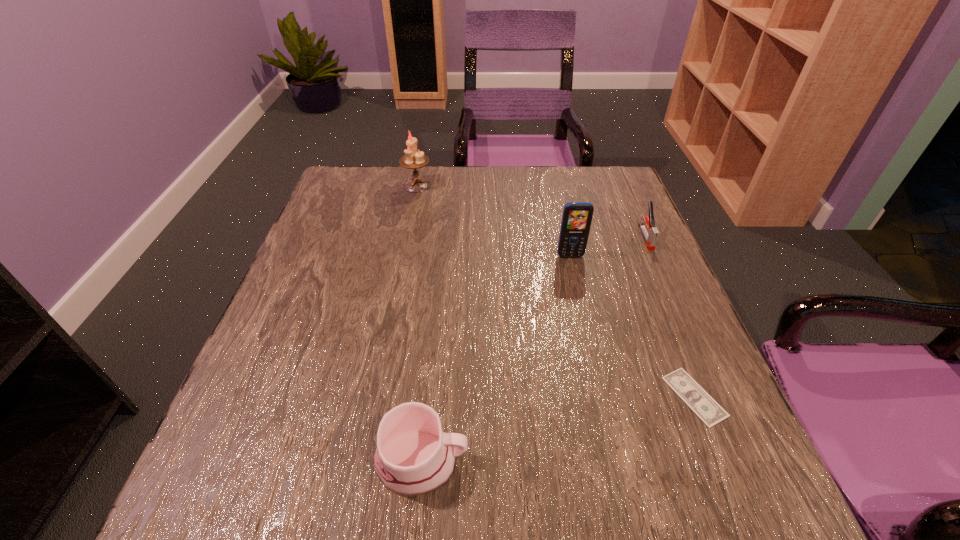
Identify the location of free space at the far left corner of the desktop. Image resolution: width=960 pixels, height=540 pixels. (385, 166).

Where is `free spot between the fourth nearest object and the money`? This screenshot has height=540, width=960. free spot between the fourth nearest object and the money is located at coordinates (670, 317).

You are a GUI agent. You are given a task and a screenshot of the screen. Output one action in this format:
    pyautogui.click(x=<x>, y=<y>)
    Task: Click on the free space between the fourth nearest object and the shortest object
    The width and height of the screenshot is (960, 540).
    Given the screenshot: What is the action you would take?
    pyautogui.click(x=670, y=317)

Identify the location of free spot between the third object from right to left and the fourth farthest object. (633, 326).

I want to click on vacant area between the money and the fourth nearest object, so click(x=670, y=317).

I want to click on vacant space that is in between the fourth nearest object and the nearest object, so click(534, 349).

Identify the location of empty location between the shortest object and the third object from left to right. This screenshot has height=540, width=960. (633, 326).

The image size is (960, 540). I want to click on unoccupied area between the farthest object and the third nearest object, so click(493, 221).

In order to click on vacant space that is in between the money and the cellular telephone in this screenshot , I will do tap(633, 326).

This screenshot has height=540, width=960. Identify the location of vacant space that is in between the fourth nearest object and the nearest object. (534, 349).